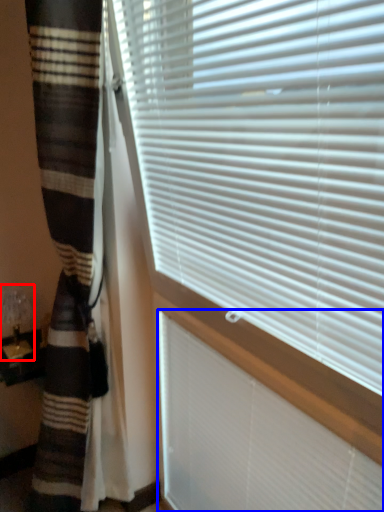
Question: Which point is further to the camera, table lamp (highlighted by a red box) or blind (highlighted by a blue box)?

Choices:
 (A) table lamp
 (B) blind

Answer: (A)